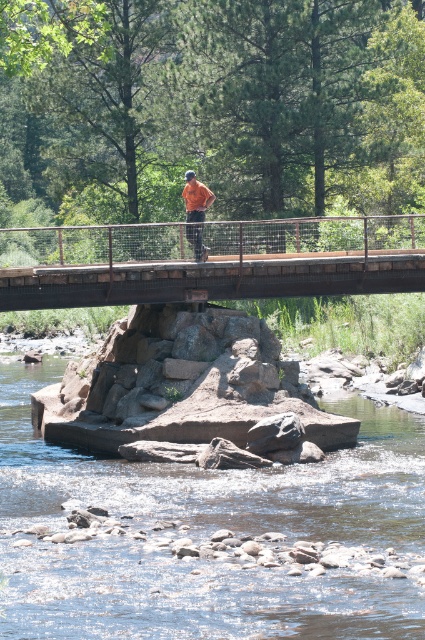
You are standing on the bridge and looking down at the river. There is a point marked at coordinates [207,536]. What does this point represent in the scene?

The point at [207,536] corresponds to the smooth rock bed at center.

You are a hiker who wants to cross the river using the smooth rock bed at center and the brown wooden bridge at center. The river is 10 meters wide. Can you safely cross using the rock bed instead of the bridge?

The smooth rock bed at center is only 7.60 meters away from the brown wooden bridge at center. Since the river is 10 meters wide, the rock bed does not span the entire river. Therefore, you cannot safely cross the river using the rock bed alone as it is shorter than the river width.